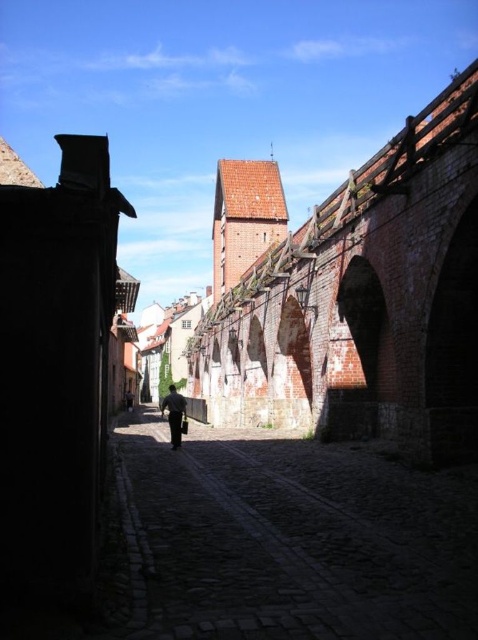
You are standing at the point marked by the coordinate point at center. Looking down the narrow cobblestone street, you see the historic brick buildings on both sides. Which direction should you walk to stay on the dark cobblestone path at center represented by point (295, 540)?

To stay on the dark cobblestone path at center represented by point (295, 540), you should walk straight ahead along the path as it continues forward between the historic brick buildings on both sides.

You are standing on the street and want to place a small decorative item on the closest surface between the dark cobblestone path at center and the dark blue fabric at center. Which surface should you choose?

The dark cobblestone path at center is closer to the viewer than the dark blue fabric at center, so you should place the item on the dark cobblestone path at center.

You are standing in the middle of the narrow cobblestone street and see the dark cobblestone path at center and the dark gray fabric pants at center. Which object is located to the right of the other?

The dark cobblestone path at center is positioned on the right side of dark gray fabric pants at center.